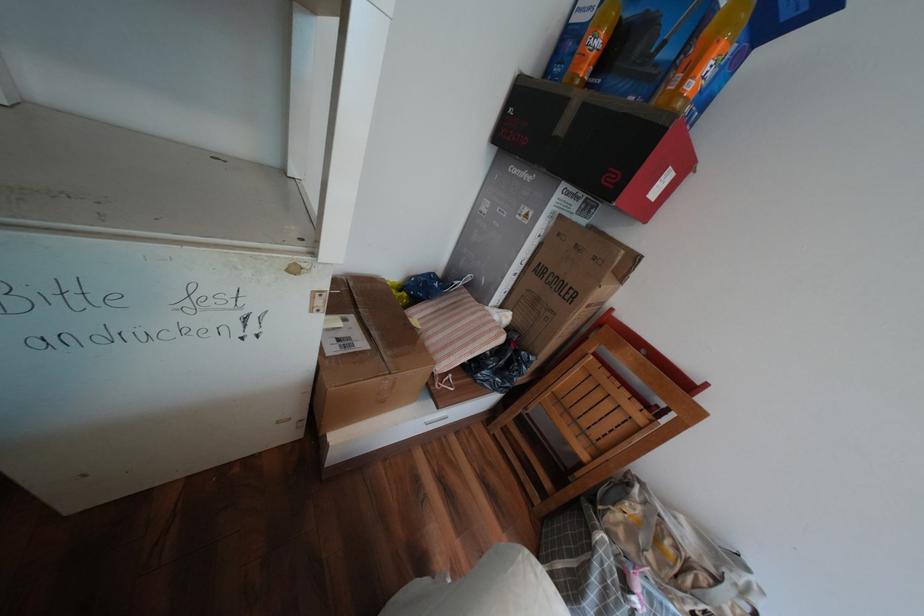
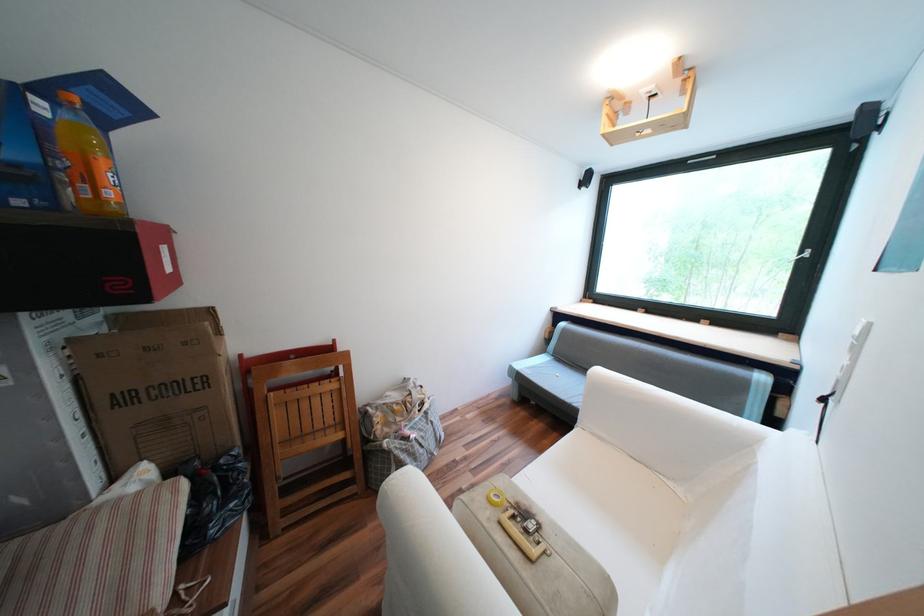
Where in the second image is the point corresponding to (638,394) from the first image?

(325, 383)